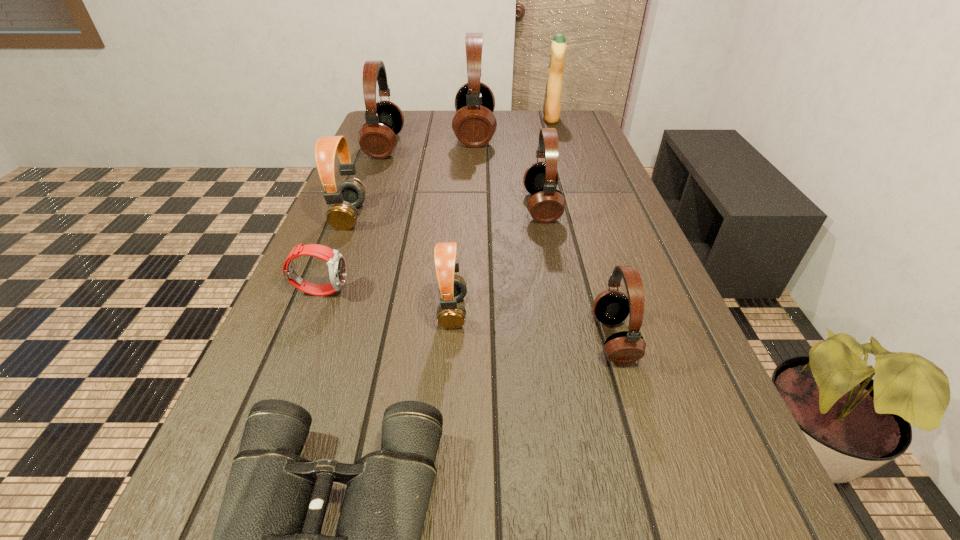
Locate an element on the screen. The image size is (960, 540). watch present at the left edge is located at coordinates (336, 262).

Where is `detergent that is at the right edge`? detergent that is at the right edge is located at coordinates (552, 100).

You are a GUI agent. You are given a task and a screenshot of the screen. Output one action in this format:
    pyautogui.click(x=<x>, y=<y>)
    Task: Click on the headset present at the right edge
    
    Given the screenshot: What is the action you would take?
    pyautogui.click(x=611, y=307)

Find the location of a particular element. The image size is (960, 540). object situated at the far left corner is located at coordinates (377, 138).

What are the coordinates of `object located at the far right corner` in the screenshot? It's located at coord(552,100).

Identify the location of vacant space at the left edge of the desktop. This screenshot has width=960, height=540. (317, 355).

Find the location of `free space at the right edge of the desktop`. free space at the right edge of the desktop is located at coordinates (628, 230).

In order to click on free spot between the rightmost headset and the farther brown headset in this screenshot , I will do `click(482, 278)`.

Locate an element on the screen. This screenshot has height=540, width=960. vacant space that's between the left brown headset and the second black headset from left to right is located at coordinates (412, 175).

Where is `object identified as the eighth closest to the second black headset from left to right`? object identified as the eighth closest to the second black headset from left to right is located at coordinates (267, 539).